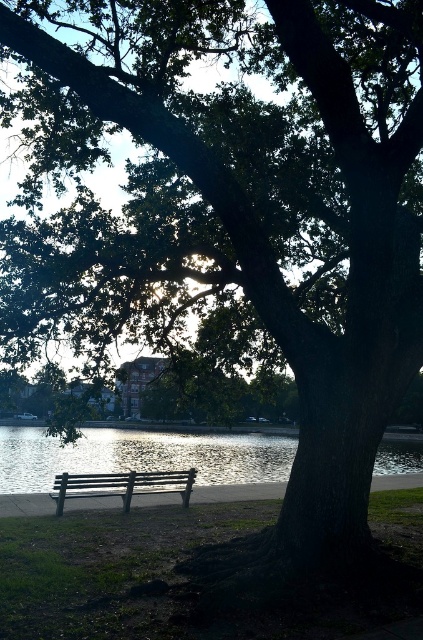
Question: Can you confirm if glistening water at bench left is thinner than black wooden bench at lower center?

Choices:
 (A) yes
 (B) no

Answer: (B)

Question: Is glistening water at bench left behind black wooden bench at lower center?

Choices:
 (A) yes
 (B) no

Answer: (A)

Question: Which point is farther to the camera?

Choices:
 (A) (54, 476)
 (B) (131, 451)

Answer: (B)

Question: Where is glistening water at bench left located in relation to black wooden bench at lower center in the image?

Choices:
 (A) right
 (B) left

Answer: (A)

Question: Among these points, which one is farthest from the camera?

Choices:
 (A) (277, 452)
 (B) (129, 476)

Answer: (A)